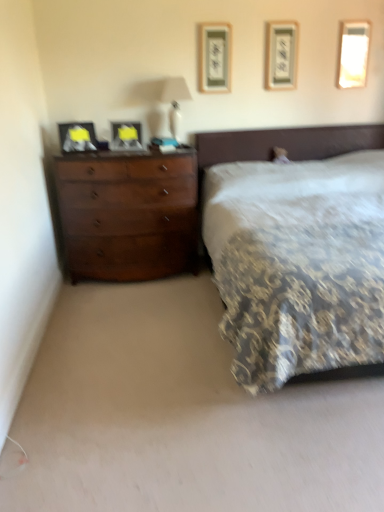
Question: In the image, is metallic silver picture frame at upper center, which is the fourth picture frame from left to right, positioned in front of or behind matte black picture frame at center, marked as the second picture frame in a left-to-right arrangement?

Choices:
 (A) front
 (B) behind

Answer: (B)

Question: Visually, is metallic silver picture frame at upper center, the 2th picture frame when ordered from right to left, positioned to the left or to the right of matte black picture frame at center, marked as the second picture frame in a left-to-right arrangement?

Choices:
 (A) left
 (B) right

Answer: (B)

Question: Estimate the real-world distances between objects in this image. Which object is closer to the patterned fabric bed at center?

Choices:
 (A) dark wood dresser at left
 (B) white glossy lampshade at upper center
 (C) metallic silver picture frame at upper center, the 2th picture frame when ordered from right to left
 (D) matte wood picture frame at upper center, arranged as the third picture frame when viewed from the left
 (E) matte black picture frame at left, placed as the 5th picture frame when sorted from right to left

Answer: (B)

Question: Considering the real-world distances, which object is farthest from the dark wood dresser at left?

Choices:
 (A) patterned fabric bed at center
 (B) matte black picture frame at left, the 1th picture frame positioned from the left
 (C) matte wood picture frame at upper center, acting as the 3th picture frame starting from the right
 (D) white glossy picture frame at upper right, which appears as the fifth picture frame when viewed from the left
 (E) matte black picture frame at center, positioned as the fourth picture frame in right-to-left order

Answer: (D)